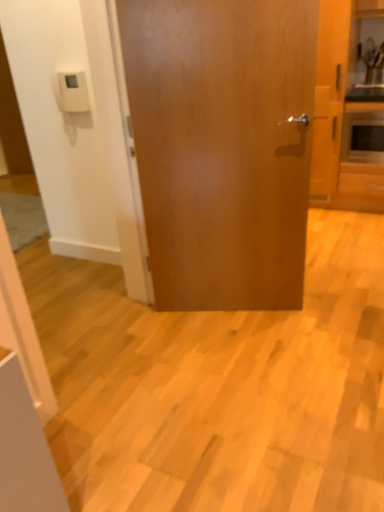
Question: Are glossy wood door at center and matte silver microwave at right making contact?

Choices:
 (A) no
 (B) yes

Answer: (A)

Question: From the image's perspective, would you say glossy wood door at center is positioned over matte silver microwave at right?

Choices:
 (A) yes
 (B) no

Answer: (B)

Question: Is glossy wood door at center behind matte silver microwave at right?

Choices:
 (A) yes
 (B) no

Answer: (B)

Question: Is glossy wood door at center closer to camera compared to matte silver microwave at right?

Choices:
 (A) yes
 (B) no

Answer: (A)

Question: Does glossy wood door at center have a smaller size compared to matte silver microwave at right?

Choices:
 (A) yes
 (B) no

Answer: (B)

Question: From a real-world perspective, is wooden cabinet at right positioned above or below glossy wood door at center?

Choices:
 (A) below
 (B) above

Answer: (B)

Question: Considering the positions of wooden cabinet at right and glossy wood door at center in the image, is wooden cabinet at right bigger or smaller than glossy wood door at center?

Choices:
 (A) small
 (B) big

Answer: (B)

Question: Visually, is wooden cabinet at right positioned to the left or to the right of glossy wood door at center?

Choices:
 (A) left
 (B) right

Answer: (B)

Question: Relative to glossy wood door at center, is wooden cabinet at right in front or behind?

Choices:
 (A) behind
 (B) front

Answer: (A)

Question: Is matte silver microwave at right taller or shorter than wooden cabinet at right?

Choices:
 (A) short
 (B) tall

Answer: (A)

Question: Do you think matte silver microwave at right is within wooden cabinet at right, or outside of it?

Choices:
 (A) outside
 (B) inside

Answer: (A)

Question: From a real-world perspective, is matte silver microwave at right above or below wooden cabinet at right?

Choices:
 (A) above
 (B) below

Answer: (B)

Question: In the image, is matte silver microwave at right on the left side or the right side of wooden cabinet at right?

Choices:
 (A) right
 (B) left

Answer: (A)

Question: From their relative heights in the image, would you say matte silver microwave at right is taller or shorter than glossy wood door at center?

Choices:
 (A) short
 (B) tall

Answer: (A)

Question: From the image's perspective, is matte silver microwave at right positioned above or below glossy wood door at center?

Choices:
 (A) above
 (B) below

Answer: (A)